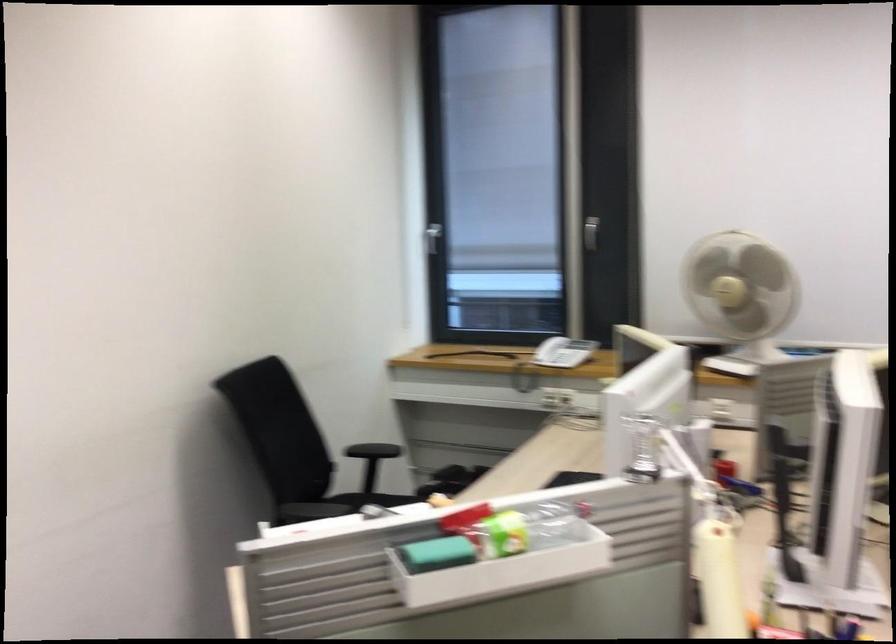
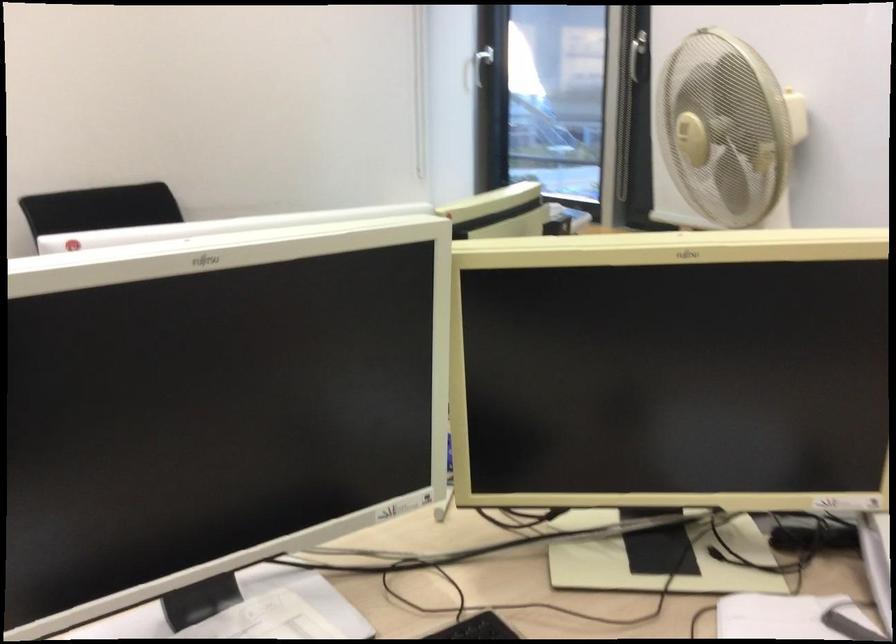
Question: I am providing you with two images of the same scene from different viewpoints. After the viewpoint changes to image2, which objects are now occluded?

Choices:
 (A) white air purifier
 (B) white window handle
 (C) scanner lid
 (D) telephone handset

Answer: (D)